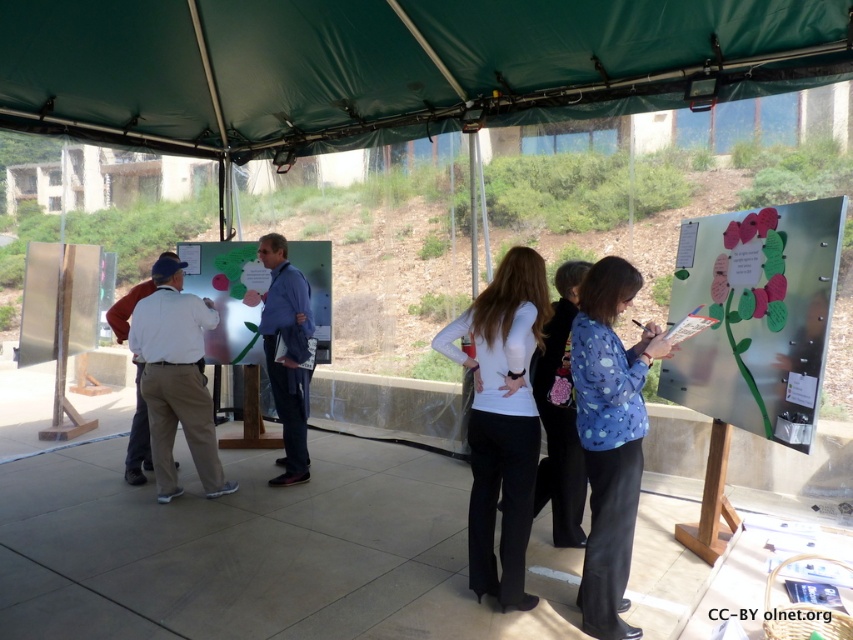
You are a photographer at the event and want to capture both the blue dotted shirt at center and the white cotton shirt at left in a single photo. Based on their positions, which shirt should you focus on first to ensure both are in frame?

Since the blue dotted shirt at center is to the right of the white cotton shirt at left, you should focus on the white cotton shirt at left first to ensure both are in frame as they are positioned side by side from left to right.